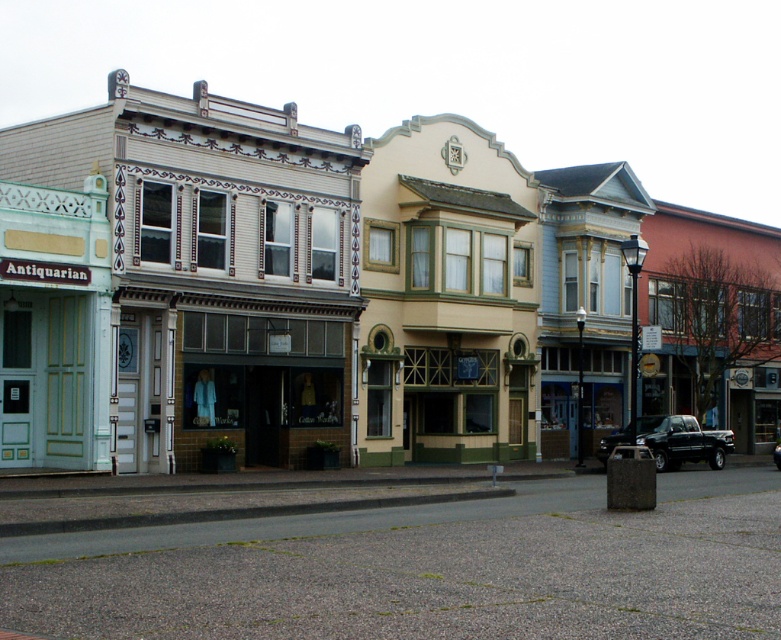
You are a delivery person who needs to park your truck. You see a black matte truck at lower right and a black glossy truck at center. Which truck has more space between it and the nearest building for you to park?

The black matte truck at lower right might be wider than the black glossy truck at center, so there might be less space available between it and the nearest building for parking.